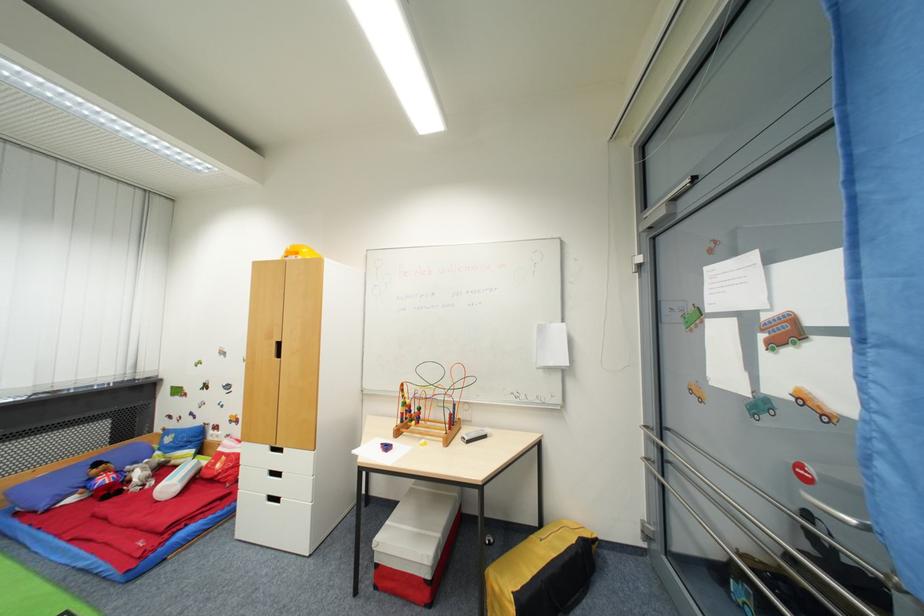
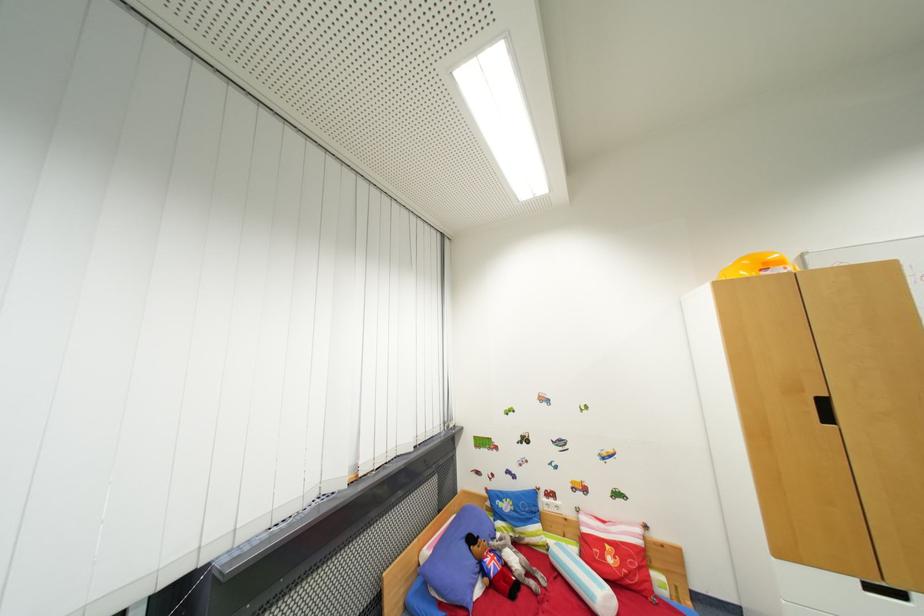
Question: The images are taken continuously from a first-person perspective. In which direction are you moving?

Choices:
 (A) Left
 (B) Right
 (C) Forward
 (D) Backward

Answer: (A)